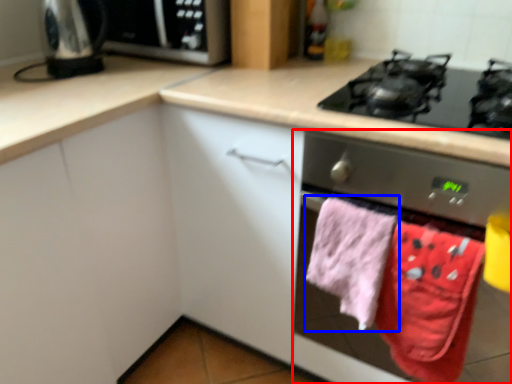
Question: Among these objects, which one is farthest to the camera, home appliance (highlighted by a red box) or beach towel (highlighted by a blue box)?

Choices:
 (A) home appliance
 (B) beach towel

Answer: (B)